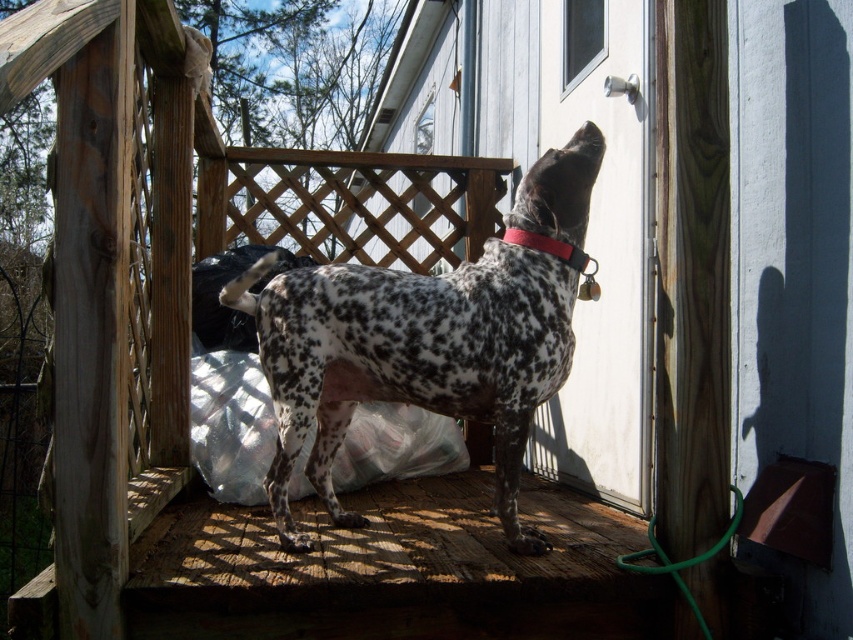
You are a delivery person trying to reach the door to drop off a package. You see the white glossy screen door at upper center and the red leather collar at upper center. Which object is closer to the door you need to approach?

The white glossy screen door at upper center is positioned over the red leather collar at upper center, so the door is closer to you than the collar. Approach the white glossy screen door at upper center first to reach the door.

You are a delivery person trying to enter the property. You see the white glossy screen door at upper center and the red leather collar at upper center. Which object is taller and would require looking up more to see?

The white glossy screen door at upper center is much taller than the red leather collar at upper center, so you would need to look up more to see the white glossy screen door at upper center.